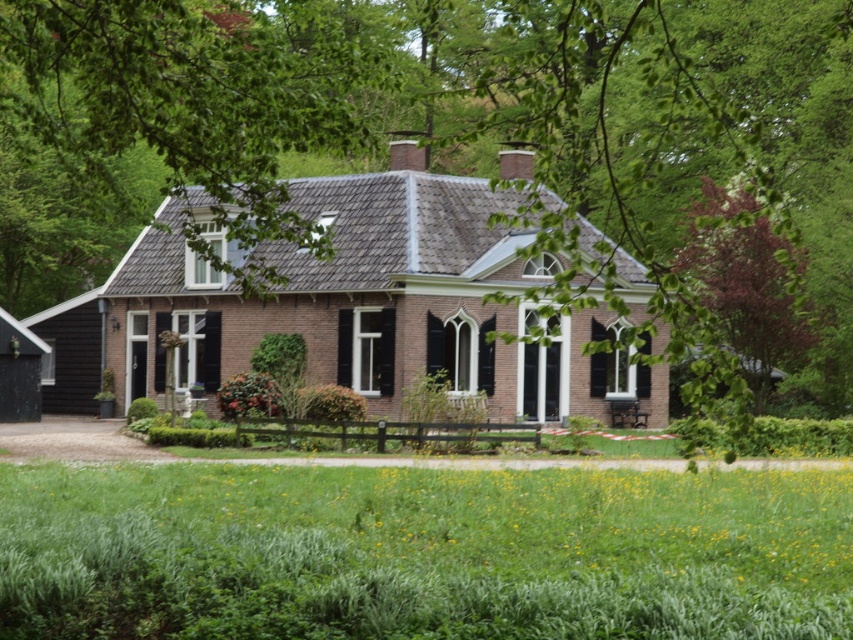
You are a painter standing at the edge of the garden. You want to paint the brown brick cottage at center but also include the green leafy tree at upper center in your painting. Which object should you focus on first to ensure both are visible in your painting?

The green leafy tree at upper center might be wider than the brown brick cottage at center, so you should focus on the brown brick cottage at center first to ensure both are visible in your painting.

You are standing at the entrance of the house and see two points marked in the garden. The first point is at coordinate point(338, 364) and the second is at point(113, 368). From your perspective, which point is closer to the house?

Point(113, 368) is closer to the house because it is behind point(338, 364), which means it is nearer to the house from the entrance perspective.

You are standing in front of the house and want to locate the point marked at coordinates (x=467, y=144). According to the scene description, where would this point be located?

The point marked at coordinates (x=467, y=144) is on the green leafy tree at upper center.